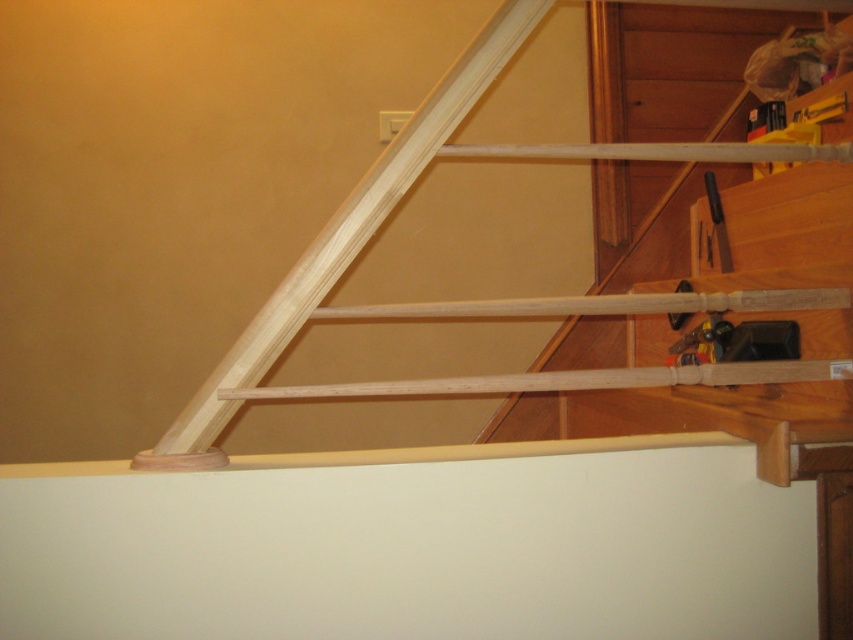
From the picture: You are moving a box up the staircase and see the black plastic screwdriver at upper right and the metallic silver tool at upper right on the landing. Which tool can you easily fit into your pocket without adjusting its position?

The black plastic screwdriver at upper right is smaller than the metallic silver tool at upper right, so it can be easily fit into your pocket without adjusting its position.

You are standing at the bottom of the staircase and looking up. There are two points marked on the wall behind the railing. The first point is at coordinates point (708, 184) and the second is at point (682, 314). Which point is closer to you?

Point (708, 184) is further to the viewer than point (682, 314), so the point closer to you is point (682, 314).

You are moving a metallic silver tool at upper right and want to place it on the natural wood handrail at upper right. Based on the scene description, will the tool fit on the handrail?

The natural wood handrail at upper right has a larger size compared to metallic silver tool at upper right, so yes, the metallic silver tool at upper right will fit on the natural wood handrail at upper right.